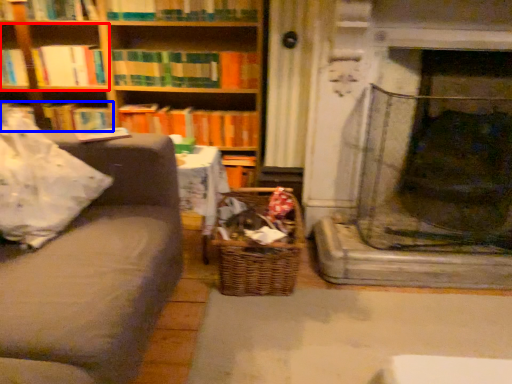
Question: Which of the following is the closest to the observer, shelf (highlighted by a red box) or book (highlighted by a blue box)?

Choices:
 (A) shelf
 (B) book

Answer: (A)